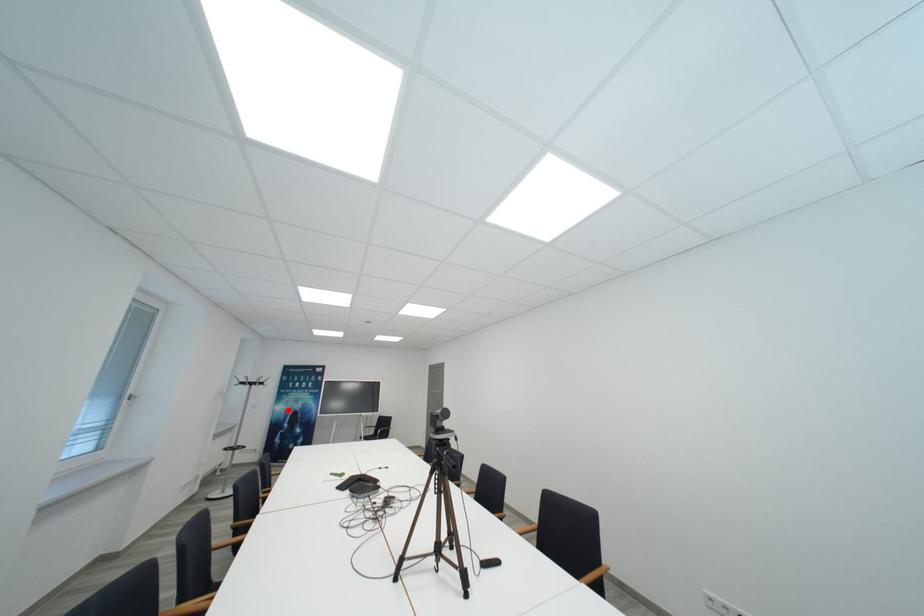
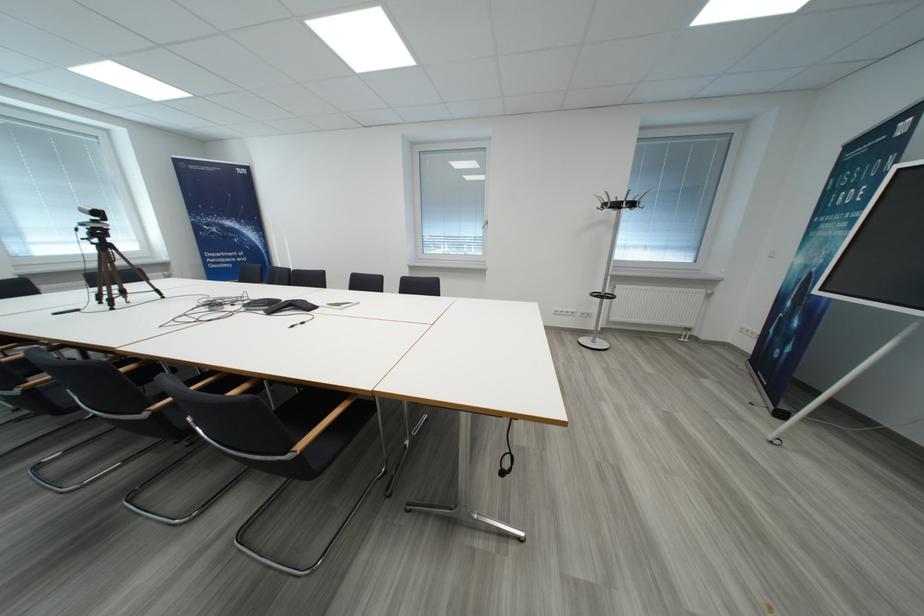
The point at the highlighted location is marked in the first image. Where is the corresponding point in the second image?

(807, 264)